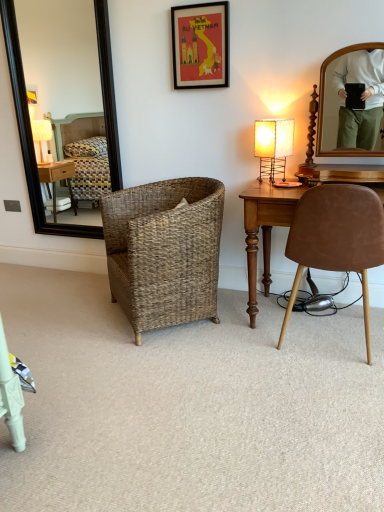
At what (x,y) coordinates should I click in order to perform the action: click on blank space above woven basket at center (from a real-world perspective). Please return your answer as a coordinate pair (x, y). Image resolution: width=384 pixels, height=512 pixels. Looking at the image, I should click on (123, 353).